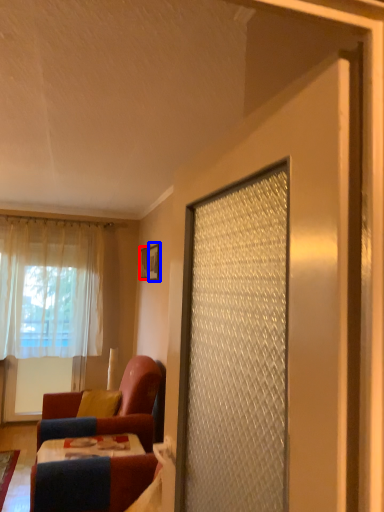
Question: Which object appears closest to the camera in this image, picture frame (highlighted by a red box) or picture frame (highlighted by a blue box)?

Choices:
 (A) picture frame
 (B) picture frame

Answer: (B)